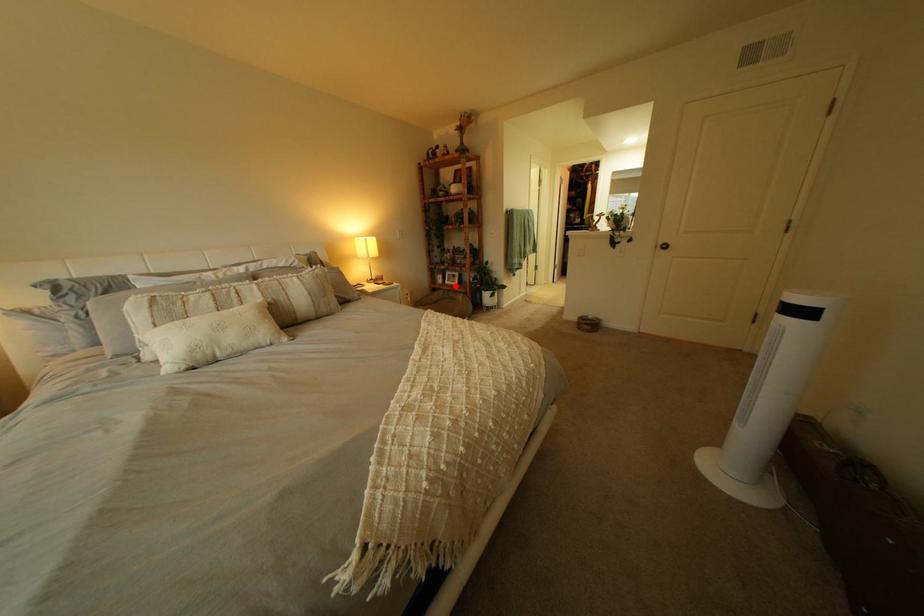
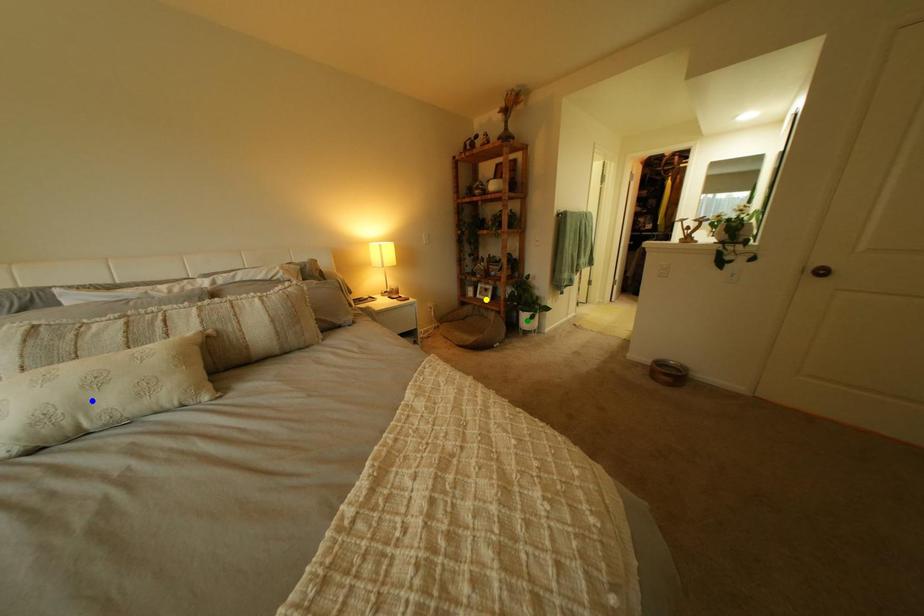
Question: I am providing you with two images of the same scene from different viewpoints. A red point is marked on the first image. You are given multiple points on the second image. Which point in image 2 represents the same 3d spot as the red point in image 1?

Choices:
 (A) blue point
 (B) green point
 (C) yellow point

Answer: (C)